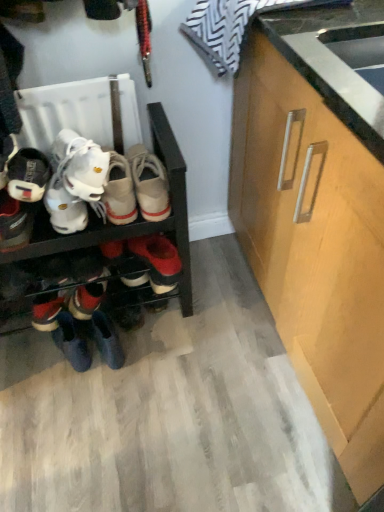
Find the location of `free space in front of wooden shoe rack at center`. free space in front of wooden shoe rack at center is located at coordinates (111, 419).